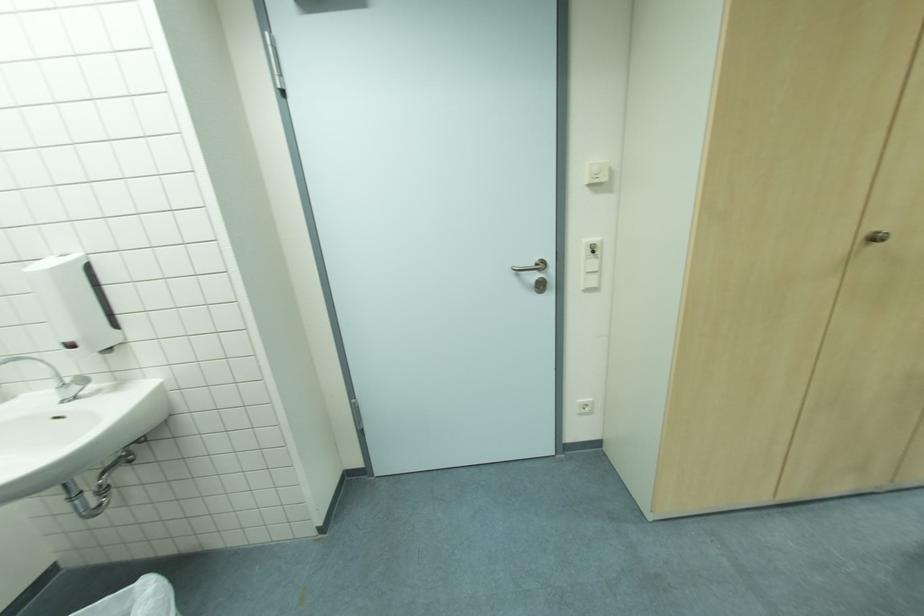
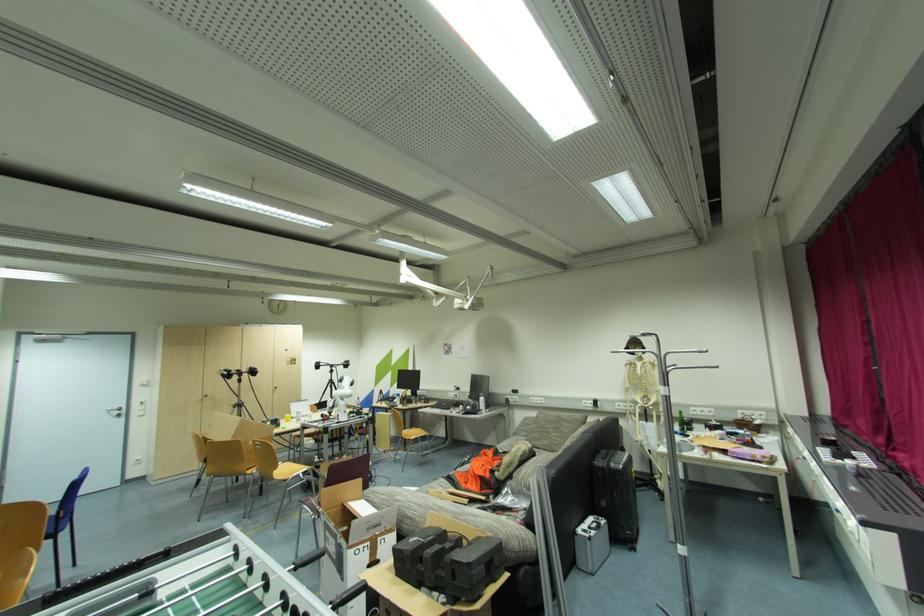
The point at (540, 276) is marked in the first image. Where is the corresponding point in the second image?

(122, 413)